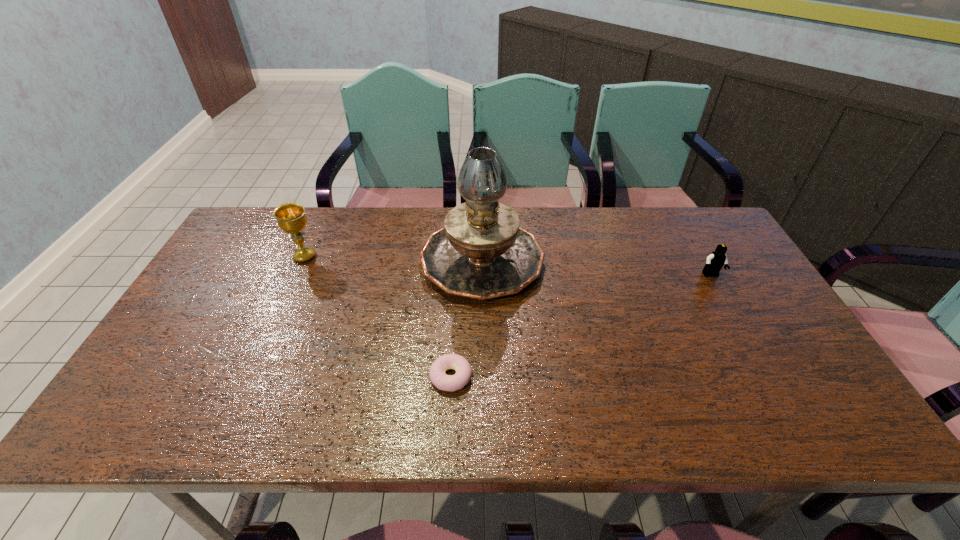
This screenshot has height=540, width=960. What are the coordinates of `object that can be found as the third closest to the second tallest object` in the screenshot? It's located at (715, 261).

Identify the location of vacant space that satisfies the following two spatial constraints: 1. on the front side of the shortest object; 2. on the right side of the chalice. (251, 376).